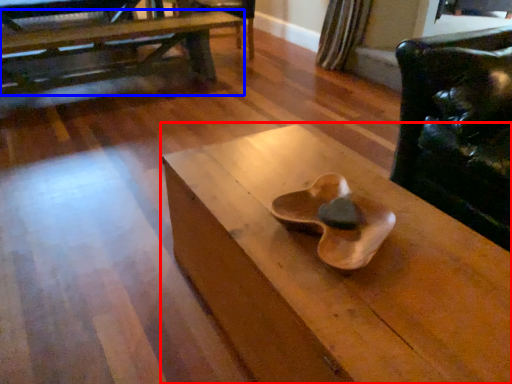
Question: Which of the following is the farthest to the observer, table (highlighted by a red box) or table (highlighted by a blue box)?

Choices:
 (A) table
 (B) table

Answer: (B)